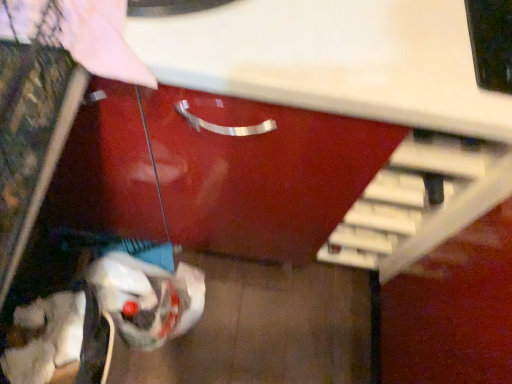
Describe the element at coordinates (324, 127) in the screenshot. I see `glossy white counter at center` at that location.

You are a GUI agent. You are given a task and a screenshot of the screen. Output one action in this format:
    pyautogui.click(x=<x>, y=<y>)
    Task: Click on the glossy white counter at center
    Image resolution: width=512 pixels, height=384 pixels.
    Given the screenshot: What is the action you would take?
    pyautogui.click(x=324, y=127)

Measure the distance between point (461, 219) and camera.

Point (461, 219) is 32.40 inches from camera.

Find the location of a particular element. This screenshot has height=384, width=512. glossy white counter at center is located at coordinates 324,127.